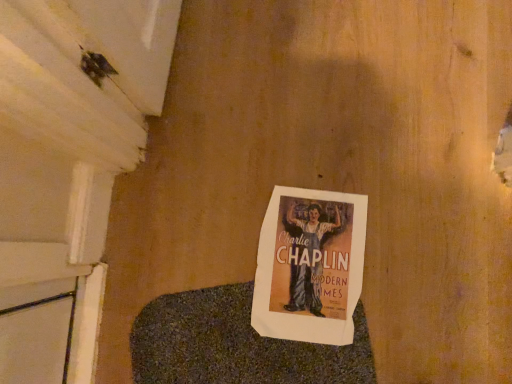
Where is `free space above matte paper poster at center (from a real-world perspective)`? This screenshot has width=512, height=384. free space above matte paper poster at center (from a real-world perspective) is located at coordinates (312, 267).